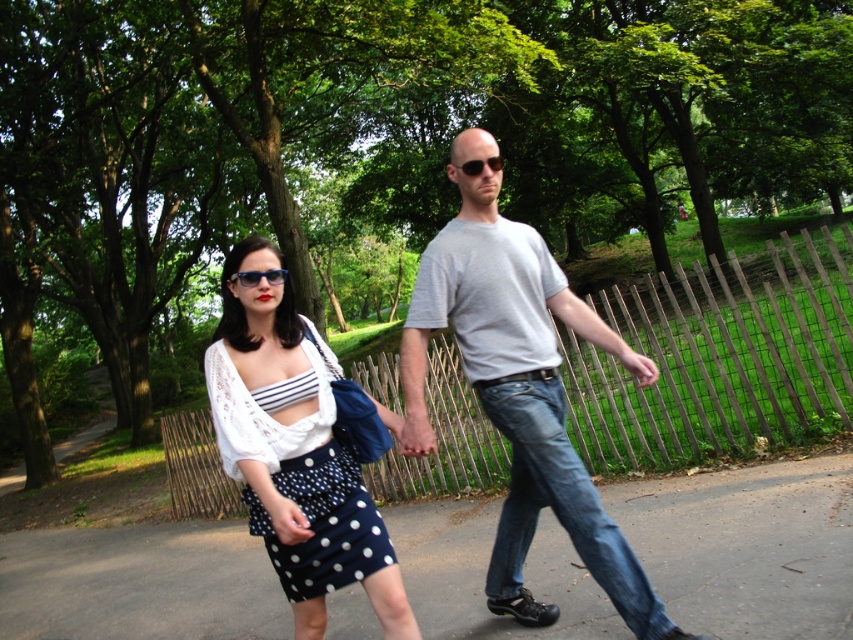
Question: Does navy polka dot skirt at center lie in front of shiny black sunglasses at center?

Choices:
 (A) yes
 (B) no

Answer: (A)

Question: Which point is closer to the camera?

Choices:
 (A) sunglasses at center
 (B) gray asphalt pavement at center
 (C) shiny black sunglasses at center

Answer: (C)

Question: Is the position of gray cotton t-shirt at center more distant than that of sunglasses at center?

Choices:
 (A) yes
 (B) no

Answer: (B)

Question: Which point is farther from the camera taking this photo?

Choices:
 (A) (271, 433)
 (B) (171, 547)

Answer: (B)

Question: Can you confirm if gray cotton t-shirt at center is thinner than shiny black sunglasses at center?

Choices:
 (A) yes
 (B) no

Answer: (B)

Question: Which object is closer to the camera taking this photo?

Choices:
 (A) gray cotton t-shirt at center
 (B) sunglasses at center
 (C) navy polka dot skirt at center

Answer: (C)